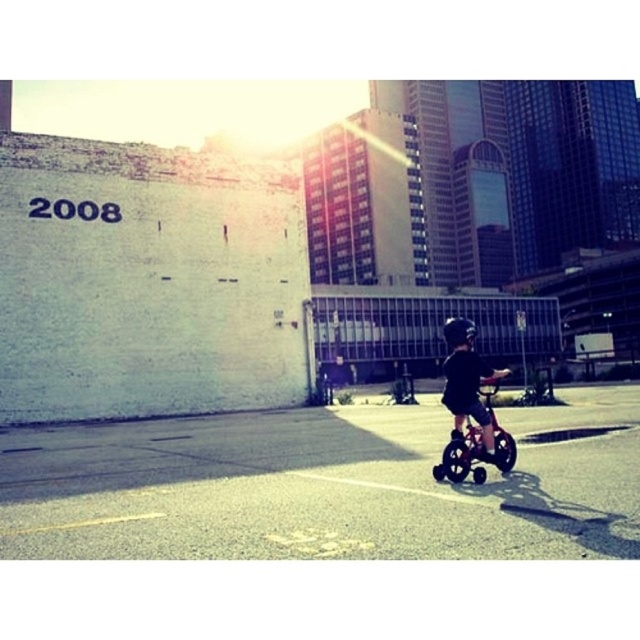
You are standing in the urban scene and want to place a small flag at the closest point between point (483, 435) and point (458, 470). Which point should you choose?

Point (483, 435) is closer to the viewer than point (458, 470), so you should place the flag at point (483, 435).

You are a parent watching your child riding a tricycle in the evening. You notice the black matte helmet at center and the black matte bicycle at center. Which object is taller from your viewpoint?

The black matte helmet at center is much taller than the black matte bicycle at center.

You are a delivery person who needs to place a package on the ground between the black matte helmet at center and the black matte bicycle at center. The package requires 25 feet of space to be safely placed. Can you fit the package between them?

The black matte helmet at center is 24.80 feet from the black matte bicycle at center, so the package requiring 25 feet of space cannot be safely placed between them as there is insufficient space.